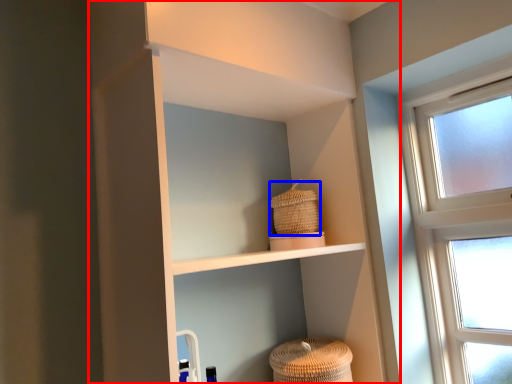
Question: Which of the following is the farthest to the observer, shelf (highlighted by a red box) or basket (highlighted by a blue box)?

Choices:
 (A) shelf
 (B) basket

Answer: (B)